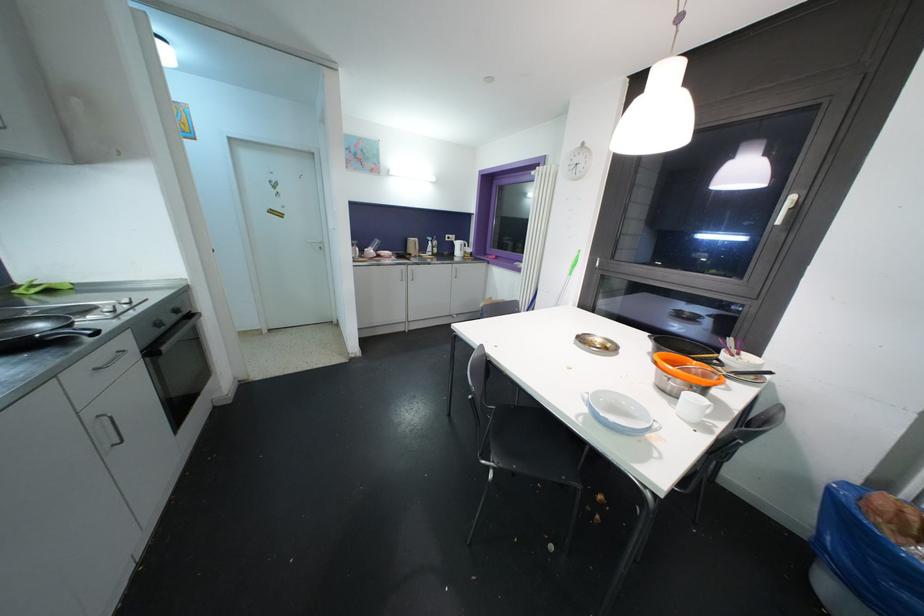
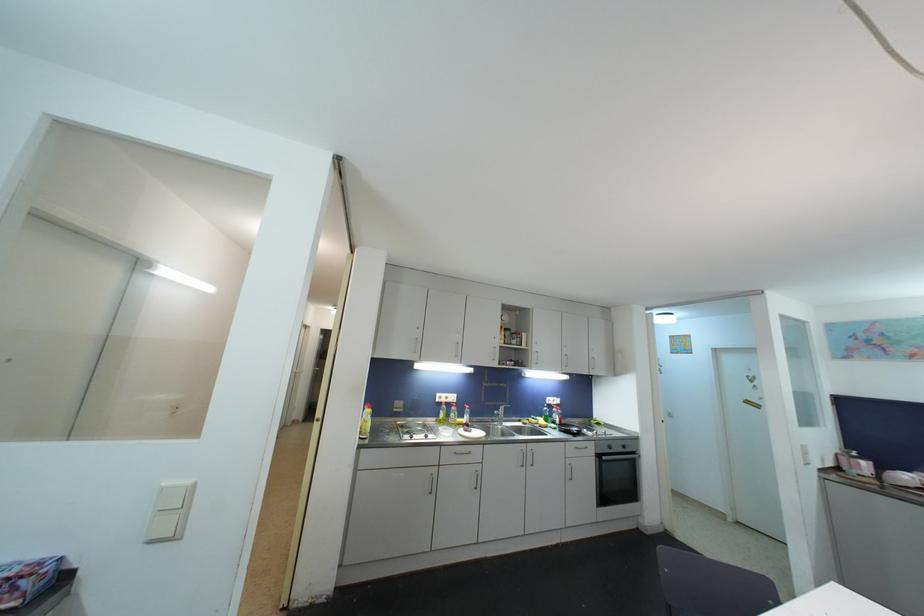
Where in the second image is the point corresponding to pixel 162 328 from the first image?

(613, 450)